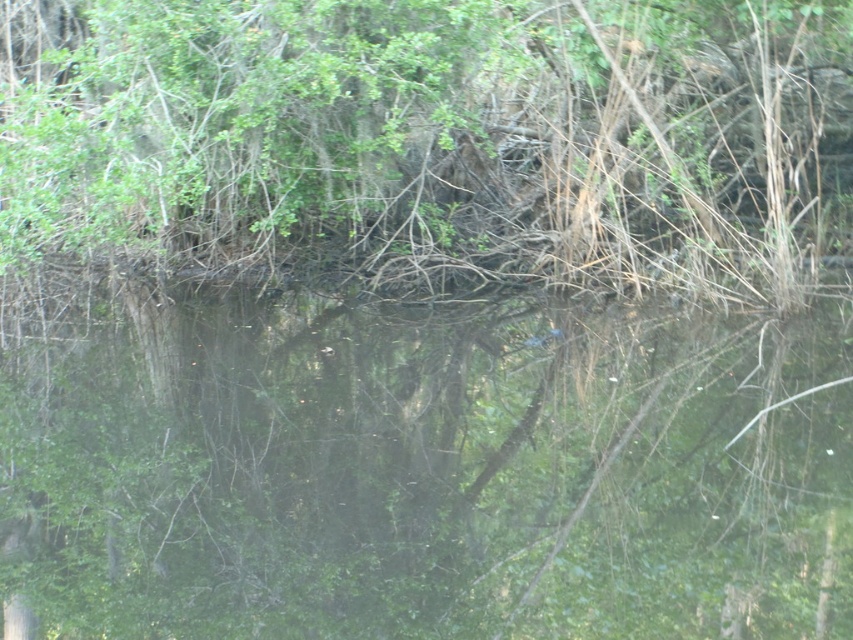
You are standing at the edge of the water and want to place a 3m wide floating platform on the green reflective water at center. Can the platform fit within the water area without overlapping the green leafy tree at upper center?

The green reflective water at center has a width less than the green leafy tree at upper center. Therefore, the 3m wide floating platform may not fit within the water area as the water is narrower than the tree, possibly leaving insufficient space.